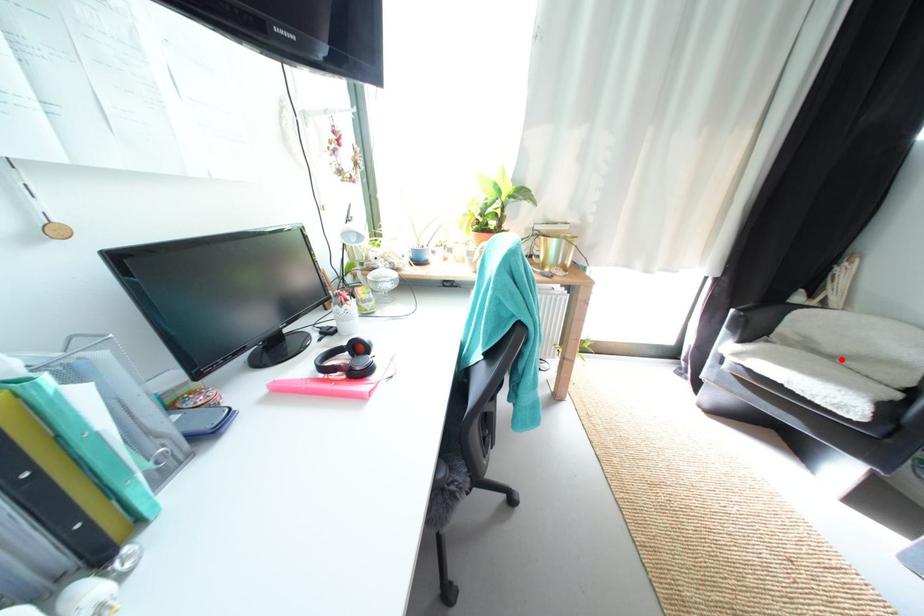
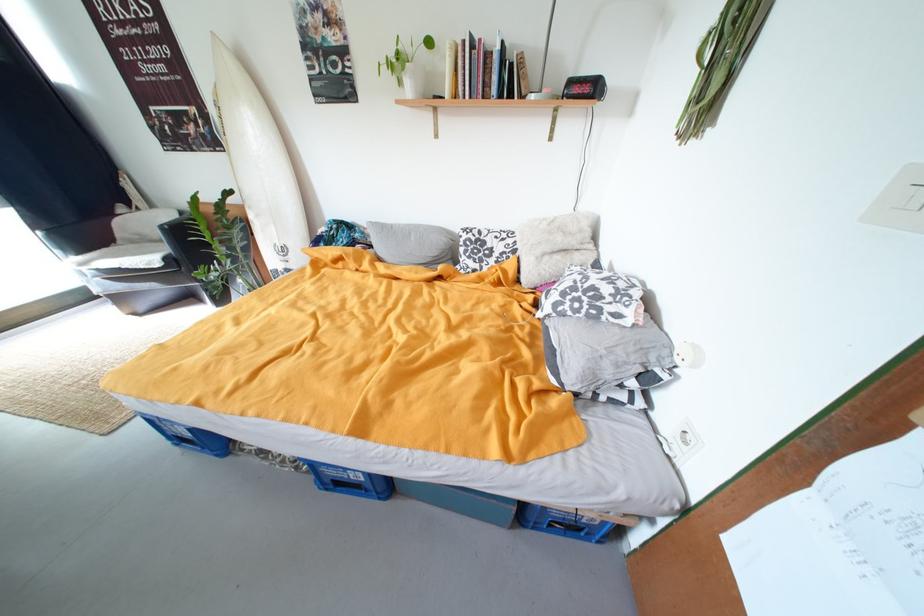
Where in the second image is the point corresponding to the highlighted location from the first image?

(169, 243)